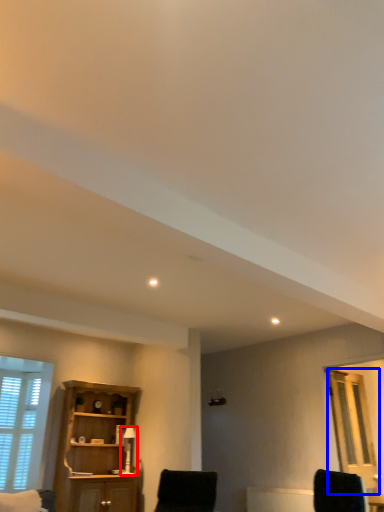
Question: Among these objects, which one is nearest to the camera, table lamp (highlighted by a red box) or glass door (highlighted by a blue box)?

Choices:
 (A) table lamp
 (B) glass door

Answer: (B)